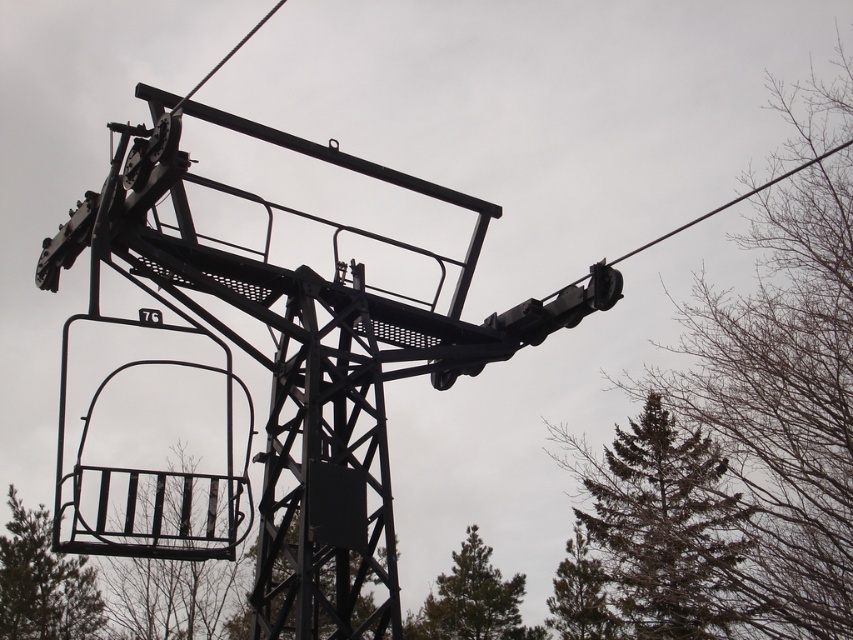
Question: Does green textured pine tree at upper right appear on the left side of green matte tree at lower center?

Choices:
 (A) yes
 (B) no

Answer: (B)

Question: Can you confirm if green matte tree at lower center is smaller than green textured pine tree at lower right?

Choices:
 (A) no
 (B) yes

Answer: (A)

Question: Which of the following is the farthest from the observer?

Choices:
 (A) green matte tree at lower center
 (B) green textured pine tree at lower right

Answer: (A)

Question: Which of the following is the closest to the observer?

Choices:
 (A) green matte chair at lower left
 (B) green matte tree at lower center

Answer: (B)

Question: Observing the image, what is the correct spatial positioning of green textured pine tree at upper right in reference to green textured pine tree at lower right?

Choices:
 (A) right
 (B) left

Answer: (A)

Question: Which of the following is the closest to the observer?

Choices:
 (A) metallic wire basket at lower left
 (B) green textured pine tree at lower right
 (C) green matte tree at lower right

Answer: (A)